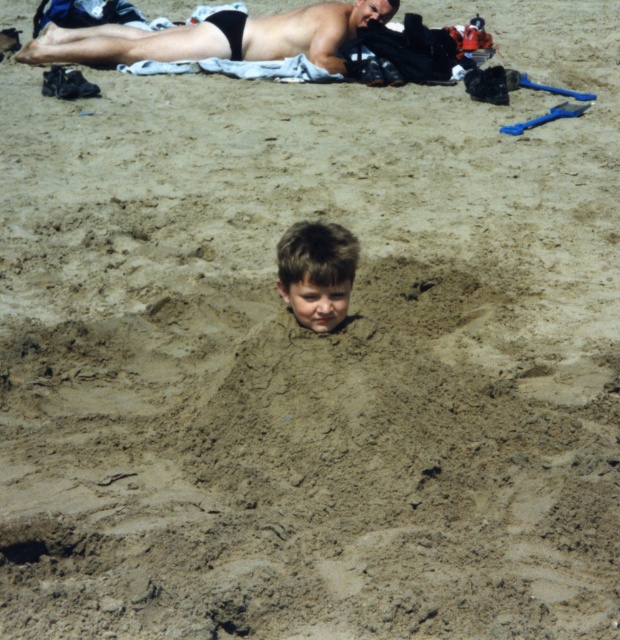
Question: Can you confirm if smooth tan skin at upper center is positioned to the right of light brown hair at center?

Choices:
 (A) no
 (B) yes

Answer: (A)

Question: Which point is closer to the camera taking this photo?

Choices:
 (A) (386, 10)
 (B) (326, 276)

Answer: (B)

Question: From the image, what is the correct spatial relationship of smooth tan skin at upper center in relation to light brown hair at center?

Choices:
 (A) right
 (B) left

Answer: (B)

Question: In this image, where is smooth tan skin at upper center located relative to light brown hair at center?

Choices:
 (A) right
 (B) left

Answer: (B)